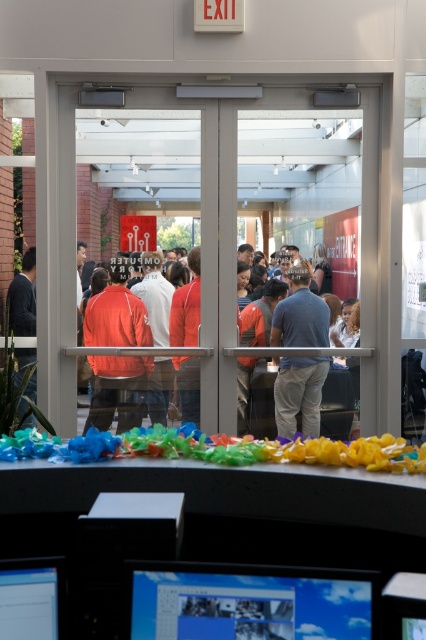
Question: Can you confirm if matte plastic monitor at lower center is positioned to the right of dark blue shirt at center?

Choices:
 (A) yes
 (B) no

Answer: (B)

Question: Which of the following is the farthest from the observer?

Choices:
 (A) matte plastic monitor at lower center
 (B) dark gray suit at left
 (C) orange fabric jacket at center
 (D) matte black monitor at lower left

Answer: (C)

Question: Among these objects, which one is nearest to the camera?

Choices:
 (A) matte black monitor at lower left
 (B) orange fabric jacket at center
 (C) dark gray suit at left

Answer: (A)

Question: Which object appears farthest from the camera in this image?

Choices:
 (A) dark gray suit at left
 (B) matte plastic monitor at lower center
 (C) orange fabric jacket at center

Answer: (C)

Question: In this image, where is matte plastic monitor at lower center located relative to dark gray suit at left?

Choices:
 (A) below
 (B) above

Answer: (A)

Question: Can you confirm if dark blue shirt at center is positioned above matte black monitor at lower left?

Choices:
 (A) yes
 (B) no

Answer: (A)